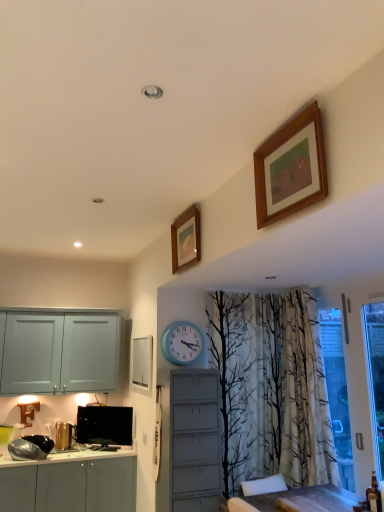
What do you see at coordinates (186, 240) in the screenshot? I see `wooden picture frame at upper center, which is counted as the second picture frame, starting from the top` at bounding box center [186, 240].

This screenshot has height=512, width=384. Identify the location of blue plastic clock at center. (182, 343).

Locate an element on the screen. The image size is (384, 512). black glossy television at lower left is located at coordinates (104, 425).

This screenshot has width=384, height=512. I want to click on wooden picture frame at upper center, acting as the second picture frame starting from the bottom, so click(186, 240).

Which of these two, wooden picture frame at upper center, which is counted as the second picture frame, starting from the top, or black glossy television at lower left, stands shorter?

black glossy television at lower left is shorter.

From the image's perspective, which is below, wooden picture frame at upper center, the 2th picture frame when ordered from back to front, or black glossy television at lower left?

black glossy television at lower left appears lower in the image.

Which point is more distant from viewer, (180,252) or (95,437)?

The point (95,437) is farther.

From a real-world perspective, is wooden picture frame at upper center, which appears as the second picture frame when viewed from the right, above or below black glossy television at lower left?

wooden picture frame at upper center, which appears as the second picture frame when viewed from the right, is above black glossy television at lower left.

Are wooden picture frame at upper center, acting as the second picture frame starting from the bottom, and wooden-framed painting at upper right, which ranks as the 1th picture frame in top-to-bottom order, making contact?

No, wooden picture frame at upper center, acting as the second picture frame starting from the bottom, is not next to wooden-framed painting at upper right, which ranks as the 1th picture frame in top-to-bottom order.

Which picture frame is the 1st one when counting from the back of the wooden-framed painting at upper right, placed as the first picture frame when sorted from front to back? Please provide its 2D coordinates.

[(186, 240)]

From a real-world perspective, which is physically above, wooden picture frame at upper center, the second picture frame positioned from the left, or wooden-framed painting at upper right, the 3th picture frame from the back?

wooden picture frame at upper center, the second picture frame positioned from the left, is physically above.

Between wooden picture frame at upper center, the 2th picture frame when ordered from back to front, and wooden-framed painting at upper right, placed as the 3th picture frame when sorted from left to right, which one appears on the left side from the viewer's perspective?

wooden picture frame at upper center, the 2th picture frame when ordered from back to front.

Is wooden-framed painting at upper right, which ranks as the 1th picture frame in top-to-bottom order, taller or shorter than black glossy television at lower left?

wooden-framed painting at upper right, which ranks as the 1th picture frame in top-to-bottom order, is taller than black glossy television at lower left.

Which object is wider, wooden-framed painting at upper right, the 3th picture frame from the back, or black glossy television at lower left?

Wider between the two is wooden-framed painting at upper right, the 3th picture frame from the back.

In the scene shown: From the image's perspective, is wooden-framed painting at upper right, arranged as the 1th picture frame when viewed from the right, on top of black glossy television at lower left?

Yes, from the image's perspective, wooden-framed painting at upper right, arranged as the 1th picture frame when viewed from the right, is on top of black glossy television at lower left.

Can you see blue plastic clock at center touching white matte picture frame at center, which is the third picture frame in front-to-back order?

blue plastic clock at center and white matte picture frame at center, which is the third picture frame in front-to-back order, are not in contact.

In terms of height, does blue plastic clock at center look taller or shorter compared to white matte picture frame at center, positioned as the 3th picture frame in top-to-bottom order?

In the image, blue plastic clock at center appears to be shorter than white matte picture frame at center, positioned as the 3th picture frame in top-to-bottom order.

Which object is wider, blue plastic clock at center or white matte picture frame at center, the 1th picture frame positioned from the left?

With larger width is blue plastic clock at center.

From a real-world perspective, who is located higher, blue plastic clock at center or white matte picture frame at center, positioned as the 3th picture frame in top-to-bottom order?

blue plastic clock at center is physically above.

Which object is further away from the camera taking this photo, wooden picture frame at upper center, positioned as the second picture frame in front-to-back order, or white matte picture frame at center, the 1th picture frame positioned from the left?

white matte picture frame at center, the 1th picture frame positioned from the left, is further away from the camera.

Which of these two, wooden picture frame at upper center, which is counted as the second picture frame, starting from the top, or white matte picture frame at center, which is the third picture frame in front-to-back order, stands taller?

Standing taller between the two is white matte picture frame at center, which is the third picture frame in front-to-back order.

Is wooden picture frame at upper center, the second picture frame positioned from the left, at the left side of white matte picture frame at center, the 1th picture frame positioned from the left?

Incorrect, wooden picture frame at upper center, the second picture frame positioned from the left, is not on the left side of white matte picture frame at center, the 1th picture frame positioned from the left.

Looking at this image, between blue plastic clock at center and wooden picture frame at upper center, positioned as the second picture frame in front-to-back order, which one has more height?

With more height is wooden picture frame at upper center, positioned as the second picture frame in front-to-back order.

Is blue plastic clock at center looking in the opposite direction of wooden picture frame at upper center, the 2th picture frame when ordered from back to front?

No, wooden picture frame at upper center, the 2th picture frame when ordered from back to front, is not at the back of blue plastic clock at center.

Which picture frame is the 1st one when counting from the right side of the blue plastic clock at center? Please provide its 2D coordinates.

[(186, 240)]

Are blue plastic clock at center and wooden picture frame at upper center, positioned as the second picture frame in front-to-back order, beside each other?

No, blue plastic clock at center is not touching wooden picture frame at upper center, positioned as the second picture frame in front-to-back order.

From the image's perspective, is wooden-framed painting at upper right, which ranks as the 1th picture frame in top-to-bottom order, above or below blue plastic clock at center?

Clearly, from the image's perspective, wooden-framed painting at upper right, which ranks as the 1th picture frame in top-to-bottom order, is above blue plastic clock at center.

Considering the relative sizes of wooden-framed painting at upper right, placed as the 3th picture frame when sorted from left to right, and blue plastic clock at center in the image provided, is wooden-framed painting at upper right, placed as the 3th picture frame when sorted from left to right, taller than blue plastic clock at center?

Correct, wooden-framed painting at upper right, placed as the 3th picture frame when sorted from left to right, is much taller as blue plastic clock at center.

Is wooden-framed painting at upper right, which ranks as the 1th picture frame in top-to-bottom order, inside or outside of blue plastic clock at center?

wooden-framed painting at upper right, which ranks as the 1th picture frame in top-to-bottom order, is located beyond the bounds of blue plastic clock at center.

Between point (278, 163) and point (203, 338), which one is positioned in front?

Positioned in front is point (278, 163).

The height and width of the screenshot is (512, 384). Identify the location of television below the wooden picture frame at upper center, the second picture frame positioned from the left (from a real-world perspective). (104, 425).

This screenshot has width=384, height=512. Find the location of `picture frame lying on the right of wooden picture frame at upper center, which appears as the second picture frame when viewed from the right`. picture frame lying on the right of wooden picture frame at upper center, which appears as the second picture frame when viewed from the right is located at coordinates (291, 168).

Considering their positions, is black glossy television at lower left positioned closer to blue plastic clock at center than wooden picture frame at upper center, positioned as the second picture frame in front-to-back order?

wooden picture frame at upper center, positioned as the second picture frame in front-to-back order, is positioned closer to the anchor blue plastic clock at center.

Considering their positions, is wooden picture frame at upper center, positioned as the second picture frame in front-to-back order, positioned further to blue plastic clock at center than black glossy television at lower left?

The object further to blue plastic clock at center is black glossy television at lower left.

Looking at the image, which one is located closer to black glossy television at lower left, wooden picture frame at upper center, positioned as the second picture frame in front-to-back order, or white matte picture frame at center, which is the third picture frame in front-to-back order?

white matte picture frame at center, which is the third picture frame in front-to-back order, is closer to black glossy television at lower left.

When comparing their distances from white matte picture frame at center, the 1th picture frame positioned from the left, does wooden-framed painting at upper right, arranged as the 1th picture frame when viewed from the right, or blue plastic clock at center seem further?

Among the two, wooden-framed painting at upper right, arranged as the 1th picture frame when viewed from the right, is located further to white matte picture frame at center, the 1th picture frame positioned from the left.

Looking at the image, which one is located closer to black glossy television at lower left, white matte picture frame at center, which is the third picture frame in front-to-back order, or blue plastic clock at center?

The object closer to black glossy television at lower left is white matte picture frame at center, which is the third picture frame in front-to-back order.

Based on their spatial positions, is black glossy television at lower left or wooden-framed painting at upper right, the 3th picture frame from the back, further from white matte picture frame at center, which is the third picture frame in front-to-back order?

wooden-framed painting at upper right, the 3th picture frame from the back.

Considering their positions, is blue plastic clock at center positioned closer to black glossy television at lower left than white matte picture frame at center, the 1th picture frame positioned from the left?

white matte picture frame at center, the 1th picture frame positioned from the left, lies closer to black glossy television at lower left than the other object.

Based on the photo, which object lies nearer to the anchor point wooden picture frame at upper center, positioned as the second picture frame in front-to-back order, white matte picture frame at center, the first picture frame positioned from the bottom, or wooden-framed painting at upper right, placed as the first picture frame when sorted from front to back?

The object closer to wooden picture frame at upper center, positioned as the second picture frame in front-to-back order, is wooden-framed painting at upper right, placed as the first picture frame when sorted from front to back.

Where is `clock between wooden-framed painting at upper right, the 3th picture frame from the back, and white matte picture frame at center, positioned as the 3th picture frame in top-to-bottom order, in the front-back direction`? This screenshot has height=512, width=384. clock between wooden-framed painting at upper right, the 3th picture frame from the back, and white matte picture frame at center, positioned as the 3th picture frame in top-to-bottom order, in the front-back direction is located at coordinates (182, 343).

Locate an element on the screen. This screenshot has height=512, width=384. clock between wooden picture frame at upper center, which appears as the second picture frame when viewed from the right, and white matte picture frame at center, which is the third picture frame in front-to-back order, from top to bottom is located at coordinates (182, 343).

The width and height of the screenshot is (384, 512). I want to click on picture frame between wooden picture frame at upper center, the second picture frame positioned from the left, and black glossy television at lower left vertically, so click(142, 362).

Where is `picture frame between wooden-framed painting at upper right, arranged as the 1th picture frame when viewed from the right, and white matte picture frame at center, positioned as the 3th picture frame in top-to-bottom order, in the front-back direction`? This screenshot has height=512, width=384. picture frame between wooden-framed painting at upper right, arranged as the 1th picture frame when viewed from the right, and white matte picture frame at center, positioned as the 3th picture frame in top-to-bottom order, in the front-back direction is located at coordinates (x=186, y=240).